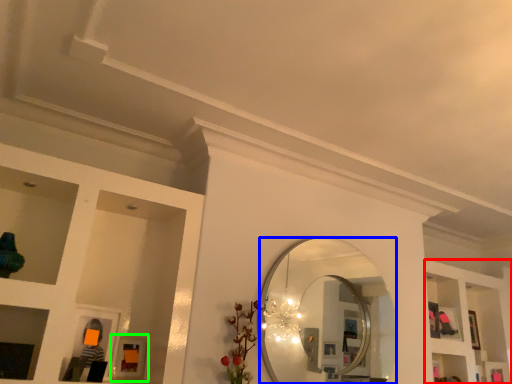
Question: Considering the real-world distances, which object is farthest from shelf (highlighted by a red box)? mirror (highlighted by a blue box) or picture frame (highlighted by a green box)?

Choices:
 (A) mirror
 (B) picture frame

Answer: (B)